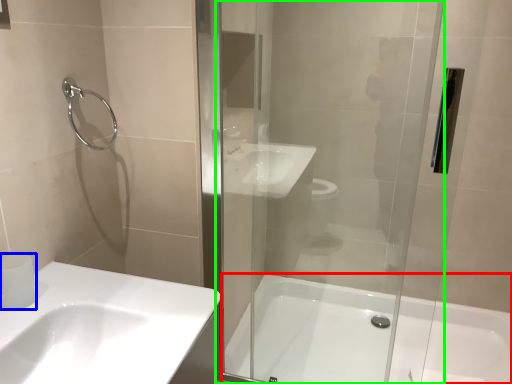
Question: Estimate the real-world distances between objects in this image. Which object is closer to bathtub (highlighted by a red box), toilet paper (highlighted by a blue box) or screen door (highlighted by a green box)?

Choices:
 (A) toilet paper
 (B) screen door

Answer: (B)